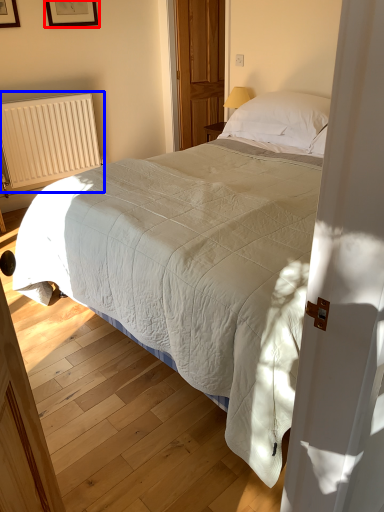
Question: Which object appears closest to the camera in this image, picture frame (highlighted by a red box) or radiator (highlighted by a blue box)?

Choices:
 (A) picture frame
 (B) radiator

Answer: (B)